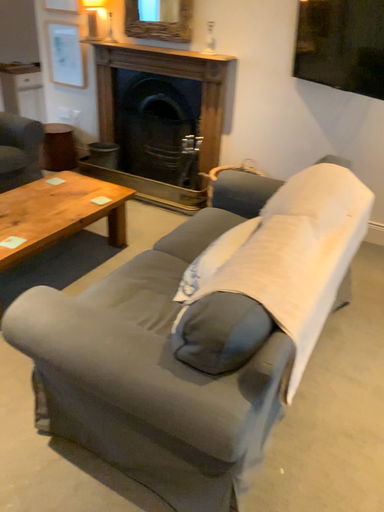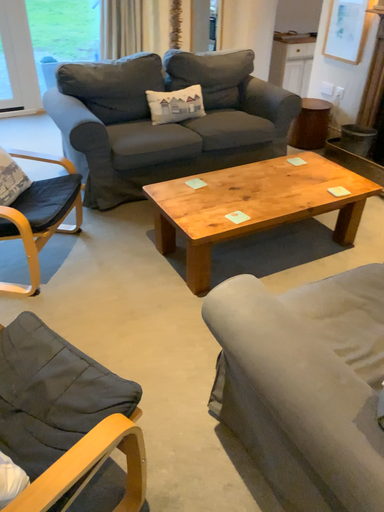
Question: How did the camera likely rotate when shooting the video?

Choices:
 (A) rotated right
 (B) rotated left

Answer: (B)